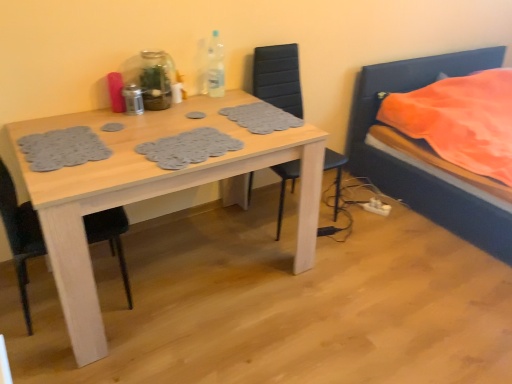
You are a GUI agent. You are given a task and a screenshot of the screen. Output one action in this format:
    pyautogui.click(x=<x>, y=<y>)
    Task: Click on the free space on the front side of white plastic power plugs and sockets at lower right
    The width and height of the screenshot is (512, 384).
    Given the screenshot: What is the action you would take?
    pyautogui.click(x=385, y=225)